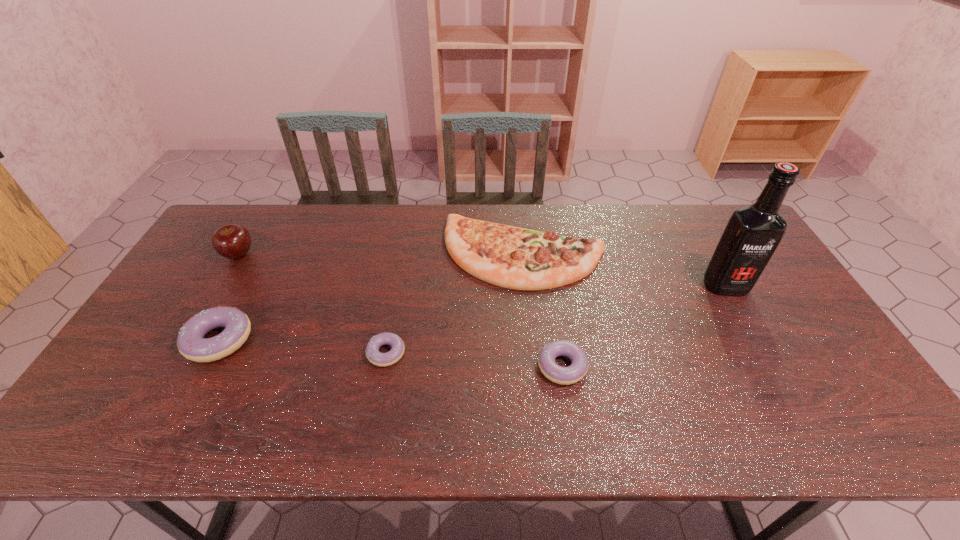
Please point out where to position a new doughnut on the right to maintain spacing. Please provide its 2D coordinates. Your answer should be formatted as a tuple, i.e. [(x, y)], where the tuple contains the x and y coordinates of a point satisfying the conditions above.

[(748, 381)]